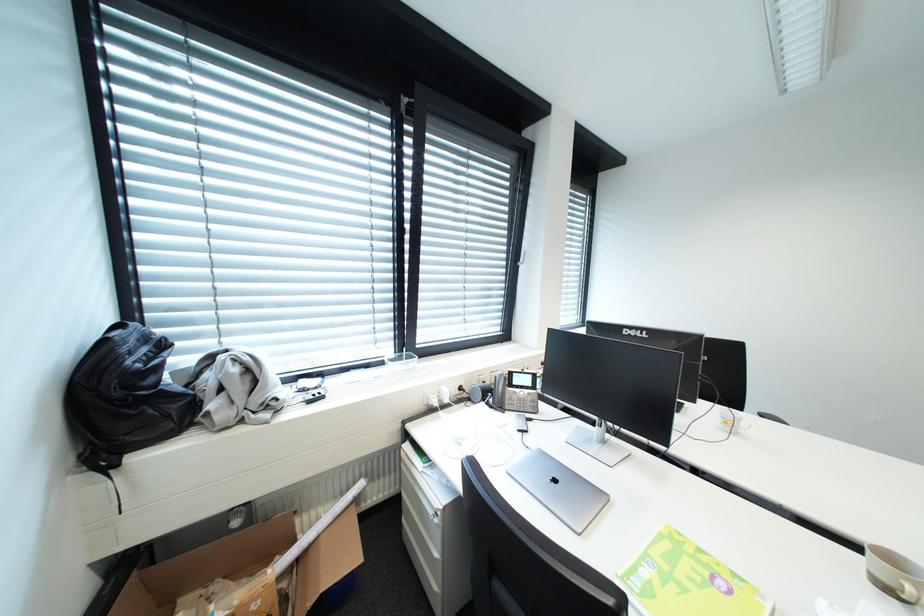
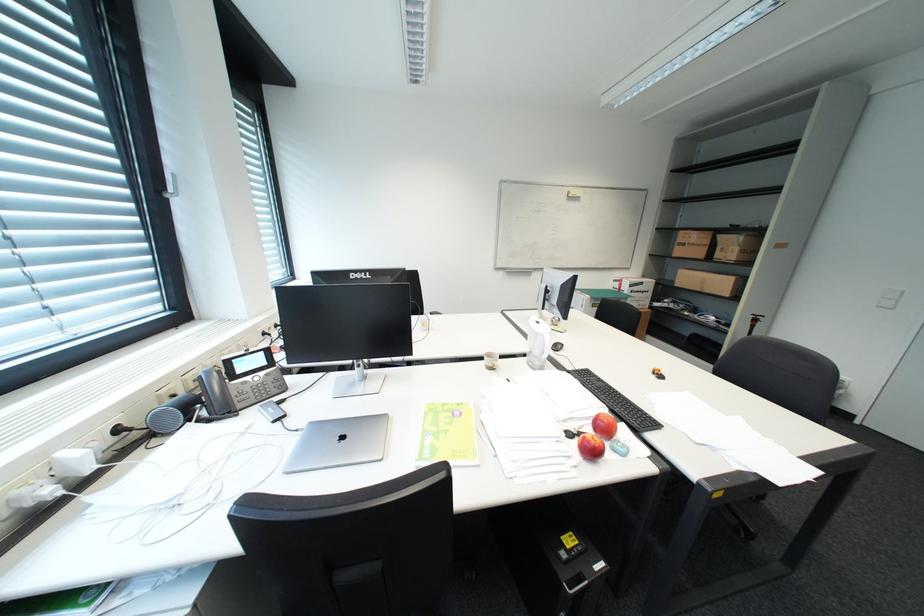
Based on the continuous images, in which direction is the camera rotating?

The rotation direction of the camera is right-down.